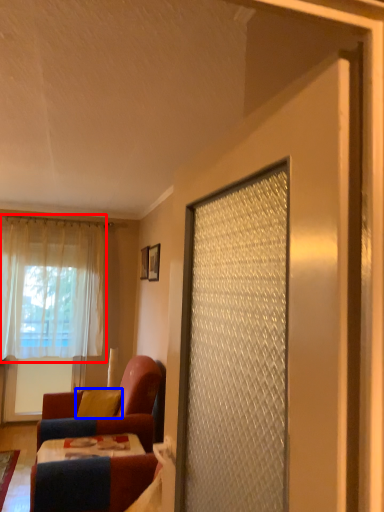
Question: Which point is further to the camera, curtain (highlighted by a red box) or pillow (highlighted by a blue box)?

Choices:
 (A) curtain
 (B) pillow

Answer: (A)